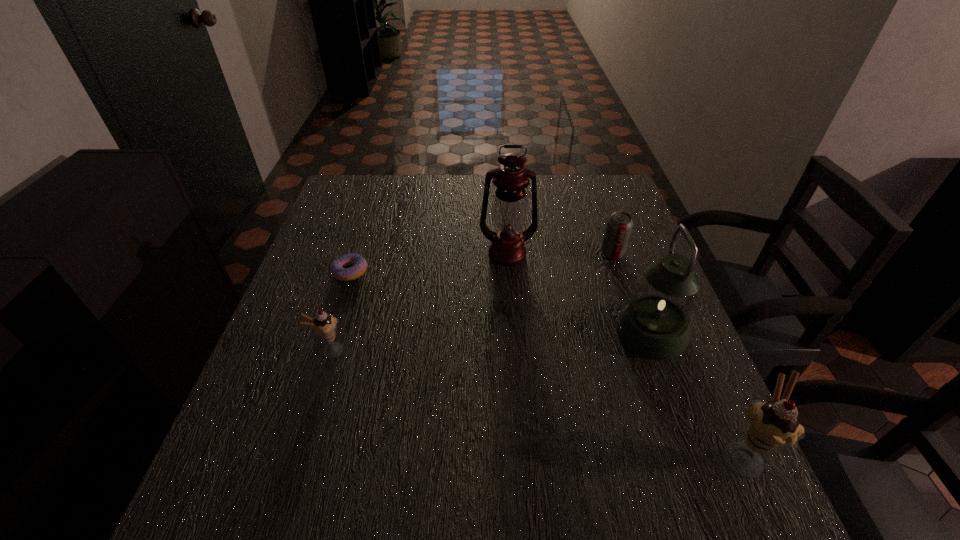
The height and width of the screenshot is (540, 960). In order to click on object located in the near right corner section of the desktop in this screenshot , I will do `click(772, 425)`.

Find the location of `vacant area at the far edge`. vacant area at the far edge is located at coordinates click(412, 210).

In the image, there is a desktop. At what (x,y) coordinates should I click in order to perform the action: click on vacant space at the near edge. Please return your answer as a coordinate pair (x, y). The image size is (960, 540). Looking at the image, I should click on (510, 460).

This screenshot has width=960, height=540. In the image, there is a desktop. What are the coordinates of `vacant region at the left edge` in the screenshot? It's located at (333, 233).

This screenshot has width=960, height=540. Identify the location of vacant space at the right edge of the desktop. (714, 407).

Where is `vacant space at the far left corner of the desktop`? The width and height of the screenshot is (960, 540). vacant space at the far left corner of the desktop is located at coordinates (351, 201).

Where is `vacant area that lies between the oil lamp and the lantern`? vacant area that lies between the oil lamp and the lantern is located at coordinates (579, 293).

Where is `vacant area between the oil lamp and the farther icecream`? vacant area between the oil lamp and the farther icecream is located at coordinates (419, 302).

Image resolution: width=960 pixels, height=540 pixels. Find the location of `free point between the shortest object and the fifth tallest object`. free point between the shortest object and the fifth tallest object is located at coordinates (481, 263).

Locate an element on the screen. The height and width of the screenshot is (540, 960). free space between the shortest object and the soda can is located at coordinates pyautogui.click(x=481, y=263).